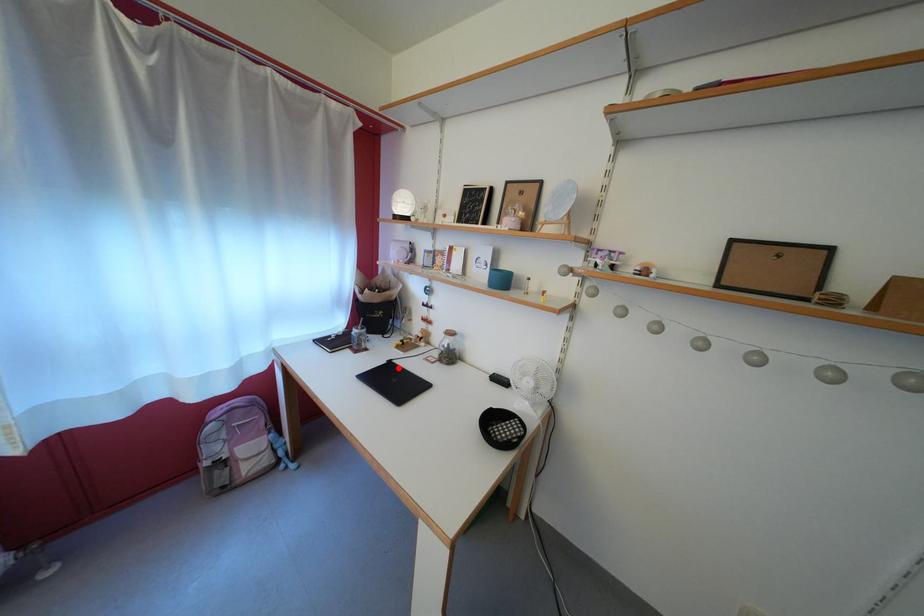
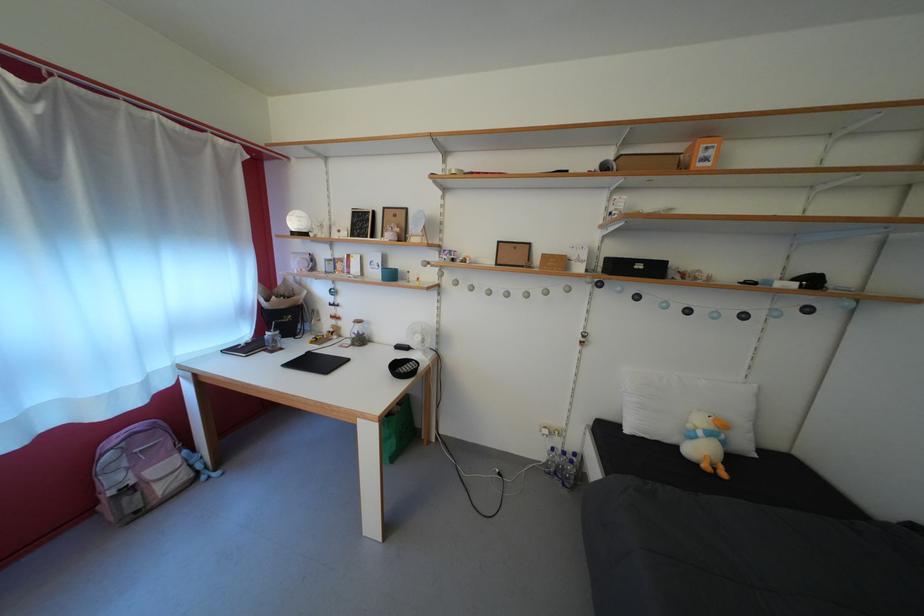
In the second image, find the point that corresponds to the highlighted location in the first image.

(317, 360)